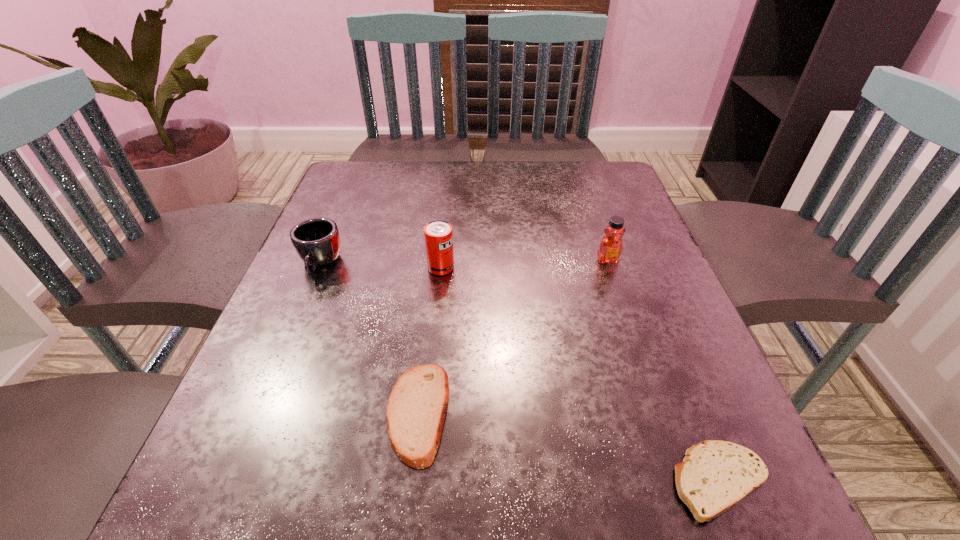
The height and width of the screenshot is (540, 960). Find the location of `free space located 0.350m on the side of the third tallest object with the handle`. free space located 0.350m on the side of the third tallest object with the handle is located at coordinates (242, 451).

At what (x,y) coordinates should I click in order to perform the action: click on vacant point located 0.260m on the right of the taller pita bread. Please return your answer as a coordinate pair (x, y). The width and height of the screenshot is (960, 540). Looking at the image, I should click on (619, 413).

This screenshot has width=960, height=540. I want to click on free spot located on the back of the right pita bread, so click(x=681, y=384).

Locate an element on the screen. The width and height of the screenshot is (960, 540). object at the left edge is located at coordinates (316, 240).

You are a GUI agent. You are given a task and a screenshot of the screen. Output one action in this format:
    pyautogui.click(x=<x>, y=<y>)
    Task: Click on the honey located in the right edge section of the desktop
    
    Given the screenshot: What is the action you would take?
    pyautogui.click(x=611, y=246)

Locate an element on the screen. The width and height of the screenshot is (960, 540). pita bread present at the right edge is located at coordinates (715, 475).

This screenshot has width=960, height=540. Find the location of `object at the near right corner`. object at the near right corner is located at coordinates (x=715, y=475).

This screenshot has width=960, height=540. In the image, there is a desktop. Identify the location of vacant space at the far edge. (497, 183).

At what (x,y) coordinates should I click in order to perform the action: click on vacant space at the near edge of the desktop. Please return your answer as a coordinate pair (x, y). The height and width of the screenshot is (540, 960). Looking at the image, I should click on (376, 518).

I want to click on vacant point at the left edge, so click(x=355, y=300).